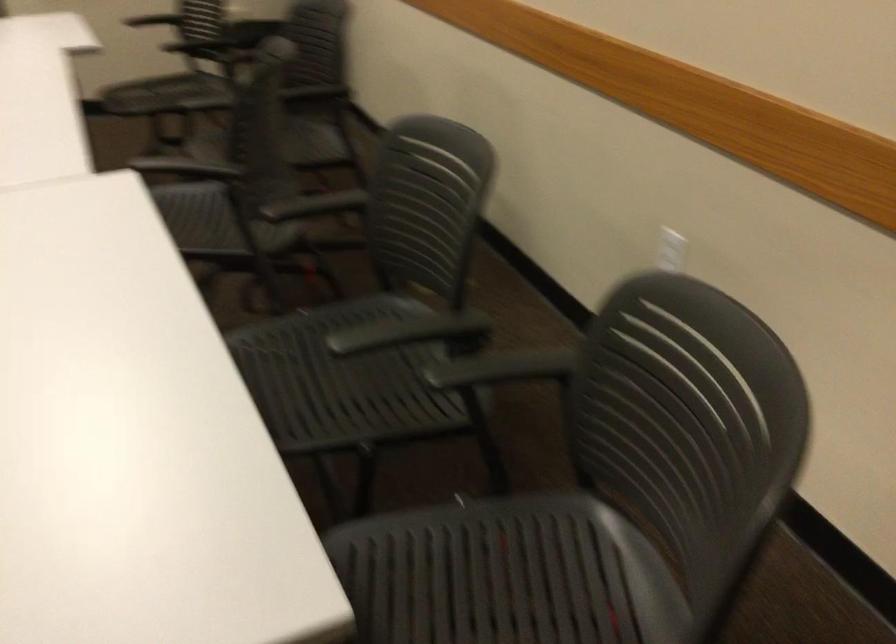
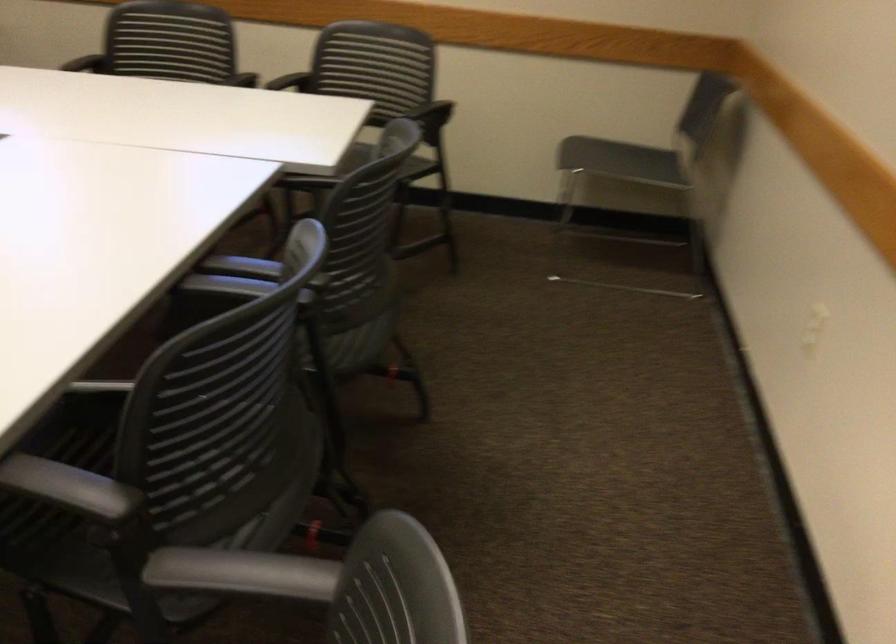
The point at (806, 308) is marked in the first image. Where is the corresponding point in the second image?

(300, 75)